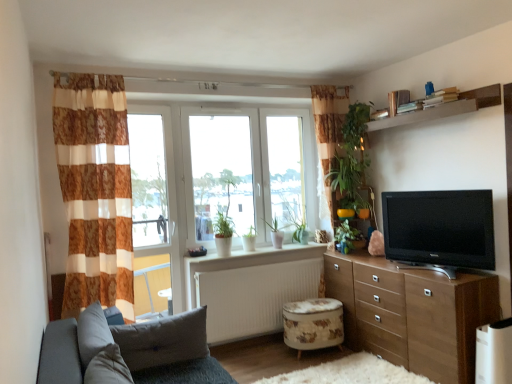
Question: From a real-world perspective, is fluffy white rug at lower center over green matte plant at center, the 2th plant in the back-to-front sequence?

Choices:
 (A) no
 (B) yes

Answer: (A)

Question: Does fluffy white rug at lower center lie behind green matte plant at center, the 2th plant in the back-to-front sequence?

Choices:
 (A) no
 (B) yes

Answer: (A)

Question: From the image's perspective, would you say fluffy white rug at lower center is positioned over green matte plant at center, marked as the first plant in a front-to-back arrangement?

Choices:
 (A) yes
 (B) no

Answer: (B)

Question: Is fluffy white rug at lower center positioned in front of green matte plant at center, the 1th plant in the right-to-left sequence?

Choices:
 (A) no
 (B) yes

Answer: (B)

Question: From a real-world perspective, is fluffy white rug at lower center located beneath green matte plant at center, the 2th plant in the back-to-front sequence?

Choices:
 (A) yes
 (B) no

Answer: (A)

Question: Considering the relative sizes of fluffy white rug at lower center and green matte plant at center, which is the 2th plant in left-to-right order, in the image provided, is fluffy white rug at lower center bigger than green matte plant at center, which is the 2th plant in left-to-right order,?

Choices:
 (A) no
 (B) yes

Answer: (B)

Question: From the image's perspective, is green matte plant at center, marked as the first plant in a front-to-back arrangement, beneath transparent glass window at center?

Choices:
 (A) yes
 (B) no

Answer: (A)

Question: Can you confirm if green matte plant at center, the 2th plant in the back-to-front sequence, is bigger than transparent glass window at center?

Choices:
 (A) yes
 (B) no

Answer: (B)

Question: Is green matte plant at center, the 1th plant in the right-to-left sequence, smaller than transparent glass window at center?

Choices:
 (A) no
 (B) yes

Answer: (B)

Question: Does green matte plant at center, the 1th plant in the right-to-left sequence, have a lesser width compared to transparent glass window at center?

Choices:
 (A) no
 (B) yes

Answer: (B)

Question: Can you confirm if green matte plant at center, the 1th plant in the right-to-left sequence, is positioned to the left of transparent glass window at center?

Choices:
 (A) yes
 (B) no

Answer: (B)

Question: Is green matte plant at center, which is the 2th plant in left-to-right order, oriented away from transparent glass window at center?

Choices:
 (A) no
 (B) yes

Answer: (A)

Question: Does transparent glass window at center have a lesser width compared to white plastic window frame at left?

Choices:
 (A) yes
 (B) no

Answer: (B)